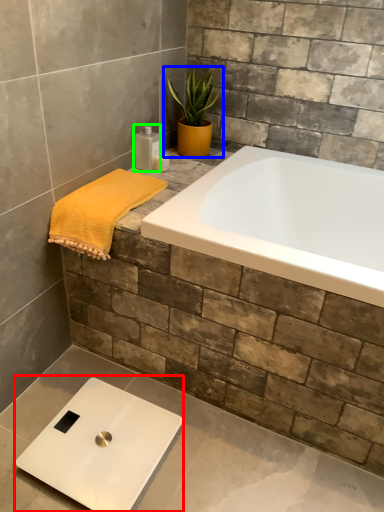
Question: Considering the real-world distances, which object is farthest from scale (highlighted by a red box)? houseplant (highlighted by a blue box) or toiletry (highlighted by a green box)?

Choices:
 (A) houseplant
 (B) toiletry

Answer: (A)